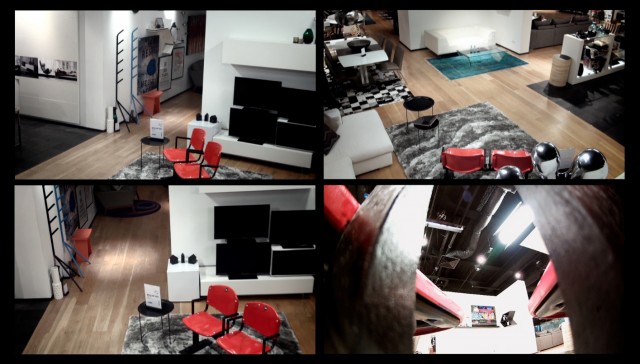
Locate an element on the screen. This screenshot has width=640, height=364. monitor is located at coordinates (304, 227).